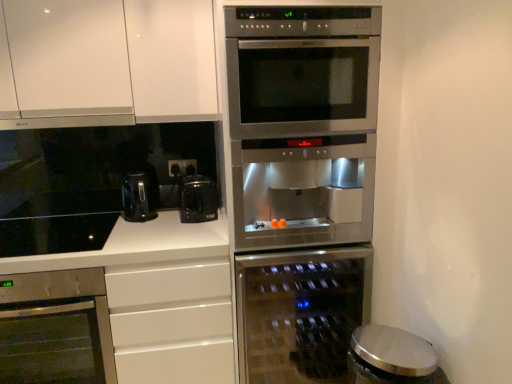
Where is `free spot below black plastic coffee machine at center (from a real-world perspective)`? The width and height of the screenshot is (512, 384). free spot below black plastic coffee machine at center (from a real-world perspective) is located at coordinates (157, 217).